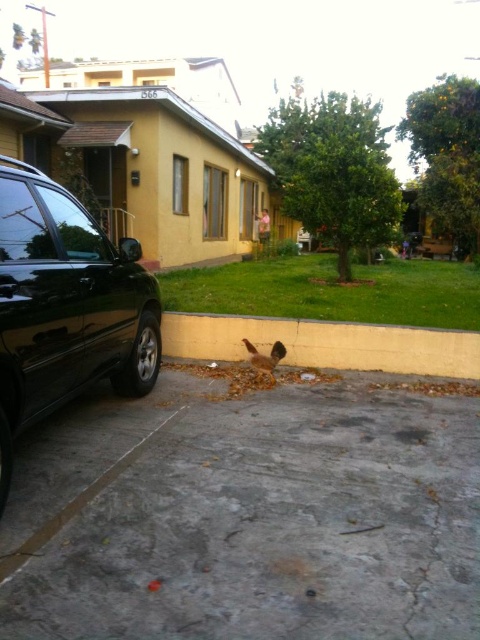
The image size is (480, 640). I want to click on yellow concrete curb at lower center, so click(324, 342).

Which is above, black glossy suv at left or brown feathered bird at lower center?

black glossy suv at left

Is point (84, 292) positioned before point (256, 369)?

Yes, it is.

The width and height of the screenshot is (480, 640). What do you see at coordinates (66, 305) in the screenshot?
I see `black glossy suv at left` at bounding box center [66, 305].

The width and height of the screenshot is (480, 640). What are the coordinates of `black glossy suv at left` in the screenshot? It's located at (66, 305).

Is gray concrete pavement at lower center positioned in front of yellow concrete curb at lower center?

That is True.

Is point (327, 452) positioned before point (429, 348)?

Yes, it is.

Is point (360, 506) more distant than point (416, 333)?

No, it is in front of (416, 333).

Where is `gray concrete pavement at lower center`? gray concrete pavement at lower center is located at coordinates [x=248, y=515].